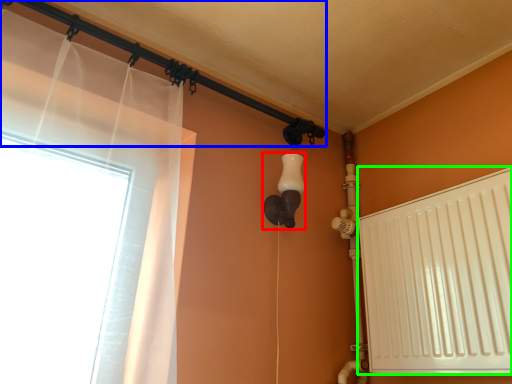
Question: Based on their relative distances, which object is nearer to light fixture (highlighted by a red box)? Choose from pipe (highlighted by a blue box) and radiator (highlighted by a green box).

Choices:
 (A) pipe
 (B) radiator

Answer: (A)